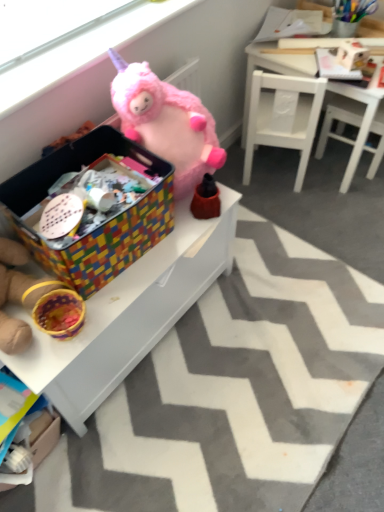
Identify the location of free area in between white matte chair at upper right and white wooden table at upper right, the 2th table ordered from the bottom. (301, 188).